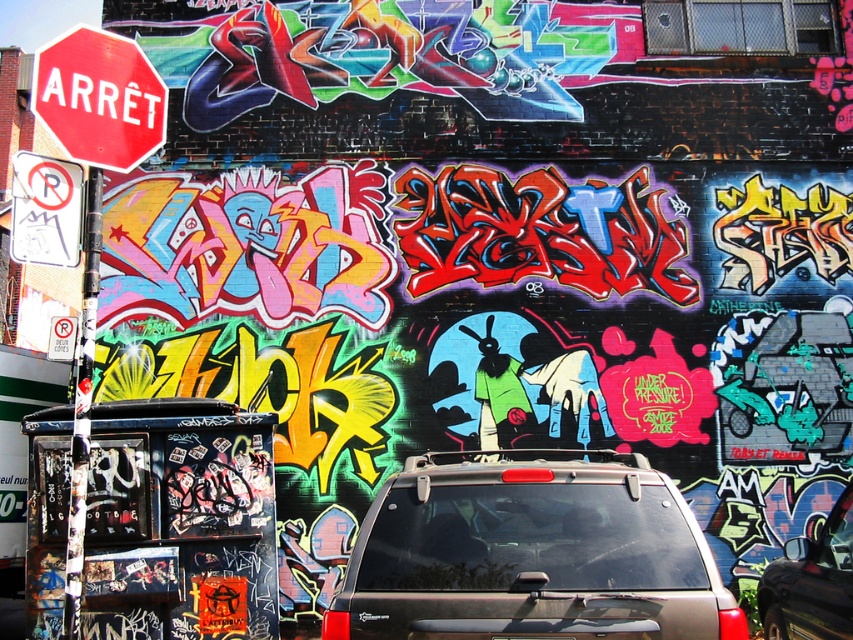
You are a delivery driver who needs to park your truck, which is 6 meters long, near the black matte car at lower right and the white paper no parking sign at left. Based on their sizes, can you estimate if there is enough space to park your truck between them?

The black matte car at lower right is larger than the white paper no parking sign at left, but the size comparison alone cannot determine the available space between them. You need to consider the distance between the two objects, not just their sizes.

You are a pedestrian standing at the crosswalk and want to cross the street. You see a metallic silver minivan at center and a black matte car at lower right. Which vehicle is closer to you?

The black matte car at lower right is closer to you because it is positioned below the metallic silver minivan at center, which is further away.

You are a delivery driver who needs to park your vehicle in this area. You have a delivery van that is the same size as the metallic silver minivan at center. There is a parking spot next to the black matte car at lower right. Can your van fit into that parking spot?

The metallic silver minivan at center is larger in size than the black matte car at lower right. Since your van is the same size as the metallic silver minivan at center, it may not fit into the parking spot next to the black matte car at lower right, which is likely sized for smaller vehicles.